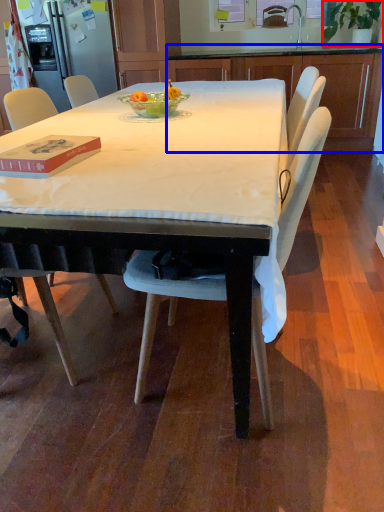
Question: Which point is closer to the camera, houseplant (highlighted by a red box) or cabinetry (highlighted by a blue box)?

Choices:
 (A) houseplant
 (B) cabinetry

Answer: (A)